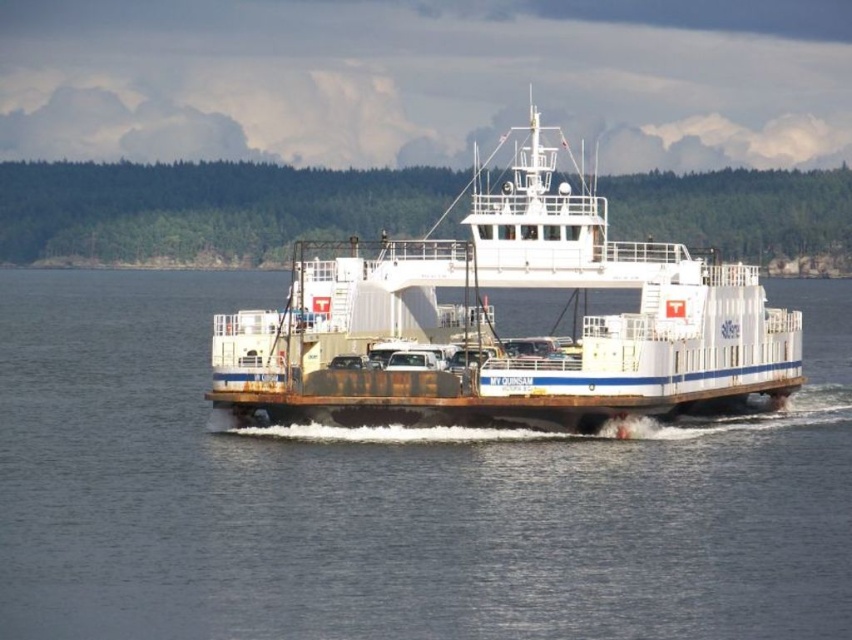
Can you confirm if white matte water at center is wider than white matte ferry at center?

Indeed, white matte water at center has a greater width compared to white matte ferry at center.

Can you confirm if white matte water at center is positioned to the left of white matte ferry at center?

No, white matte water at center is not to the left of white matte ferry at center.

Locate an element on the screen. The height and width of the screenshot is (640, 852). white matte water at center is located at coordinates (390, 496).

At what (x,y) coordinates should I click in order to perform the action: click on white matte water at center. Please return your answer as a coordinate pair (x, y). This screenshot has height=640, width=852. Looking at the image, I should click on (390, 496).